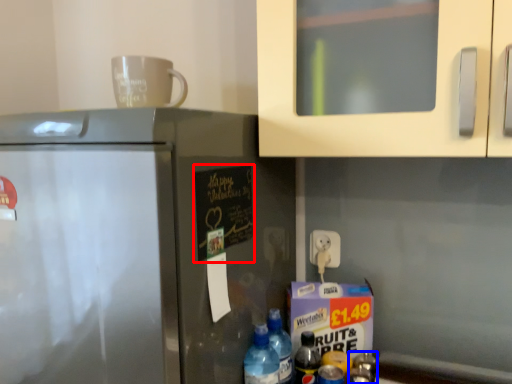
Question: Which point is further to the camera, bulletin board (highlighted by a red box) or bottle (highlighted by a blue box)?

Choices:
 (A) bulletin board
 (B) bottle

Answer: (B)